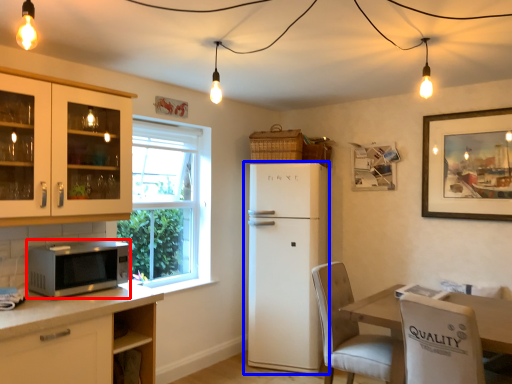
Question: Which point is further to the camera, microwave oven (highlighted by a red box) or refrigerator (highlighted by a blue box)?

Choices:
 (A) microwave oven
 (B) refrigerator

Answer: (B)